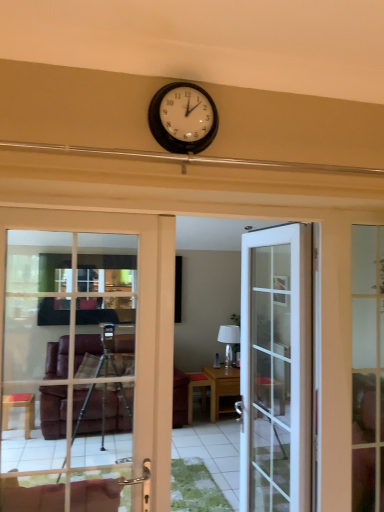
Question: Is white glass door at left, the second door positioned from the right, not close to matte black clock at upper center?

Choices:
 (A) no
 (B) yes

Answer: (A)

Question: Does white glass door at left, which is the first door in left-to-right order, appear on the left side of matte black clock at upper center?

Choices:
 (A) no
 (B) yes

Answer: (B)

Question: Is white glass door at left, which is the first door in left-to-right order, in contact with matte black clock at upper center?

Choices:
 (A) yes
 (B) no

Answer: (B)

Question: Does white glass door at left, which is the second door in back-to-front order, come in front of matte black clock at upper center?

Choices:
 (A) yes
 (B) no

Answer: (B)

Question: Is white glass door at left, acting as the 1th door starting from the front, at the right side of matte black clock at upper center?

Choices:
 (A) yes
 (B) no

Answer: (B)

Question: Does white glass door at left, the second door positioned from the right, have a greater width compared to matte black clock at upper center?

Choices:
 (A) yes
 (B) no

Answer: (A)

Question: Is matte glass door at right positioned with its back to white glass door at left, acting as the 1th door starting from the front?

Choices:
 (A) yes
 (B) no

Answer: (B)

Question: Can you confirm if matte glass door at right is thinner than white glass door at left, which is the second door in back-to-front order?

Choices:
 (A) no
 (B) yes

Answer: (B)

Question: Is matte glass door at right smaller than white glass door at left, which is the first door in left-to-right order?

Choices:
 (A) no
 (B) yes

Answer: (B)

Question: From a real-world perspective, is matte glass door at right on white glass door at left, which is the second door in back-to-front order?

Choices:
 (A) no
 (B) yes

Answer: (A)

Question: Is the surface of matte glass door at right in direct contact with white glass door at left, the second door positioned from the right?

Choices:
 (A) yes
 (B) no

Answer: (B)

Question: From the image's perspective, is matte glass door at right beneath white glass door at left, acting as the 1th door starting from the front?

Choices:
 (A) yes
 (B) no

Answer: (A)

Question: Can you confirm if wooden table at center, placed as the second table when sorted from right to left, is wider than white glossy lamp at center?

Choices:
 (A) yes
 (B) no

Answer: (A)